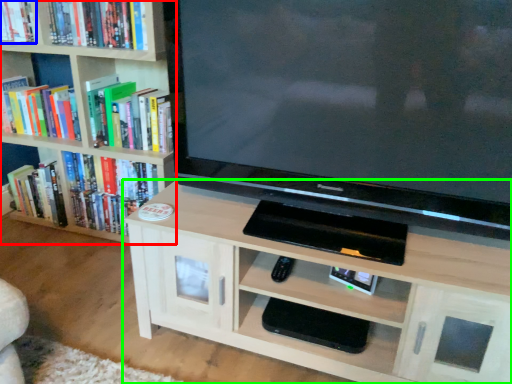
Question: Which object is positioned closest to bookcase (highlighted by a red box)? Select from book (highlighted by a blue box) and shelf (highlighted by a green box).

Choices:
 (A) book
 (B) shelf

Answer: (A)